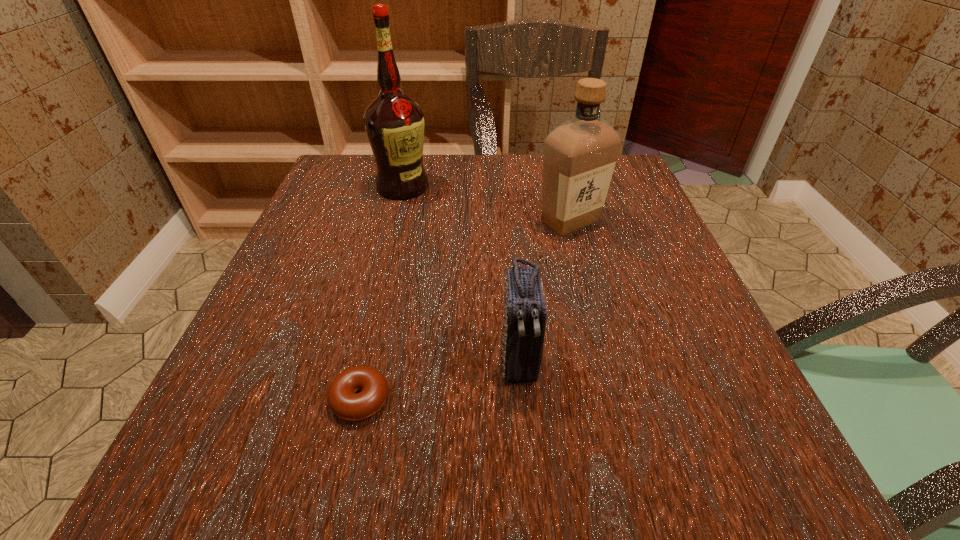
Identify the location of the farthest object. (394, 123).

Where is `the tallest object`? the tallest object is located at coordinates (394, 123).

You are a GUI agent. You are given a task and a screenshot of the screen. Output one action in this format:
    pyautogui.click(x=<x>, y=<y>)
    Task: Click on the liquor
    
    Given the screenshot: What is the action you would take?
    pyautogui.click(x=579, y=156)

At what (x,y) coordinates should I click in order to perform the action: click on the rightmost object. Please return your answer as a coordinate pair (x, y). Looking at the image, I should click on (579, 156).

You are a GUI agent. You are given a task and a screenshot of the screen. Output one action in this format:
    pyautogui.click(x=<x>, y=<y>)
    Task: Click on the second object from right to left
    The image size is (960, 540).
    Given the screenshot: What is the action you would take?
    pyautogui.click(x=525, y=311)

This screenshot has height=540, width=960. In order to click on the second shortest object in this screenshot , I will do `click(525, 311)`.

Where is `doughnut`? The width and height of the screenshot is (960, 540). doughnut is located at coordinates click(x=343, y=400).

This screenshot has height=540, width=960. What are the coordinates of `free space located 0.320m on the label of the farthest object` in the screenshot? It's located at (373, 303).

Locate an element on the screen. The width and height of the screenshot is (960, 540). blank space located 0.240m on the front-facing side of the liquor is located at coordinates (599, 332).

Locate an element on the screen. Image resolution: width=960 pixels, height=540 pixels. vacant space situated 0.120m with the zip open on the second object from right to left is located at coordinates (528, 482).